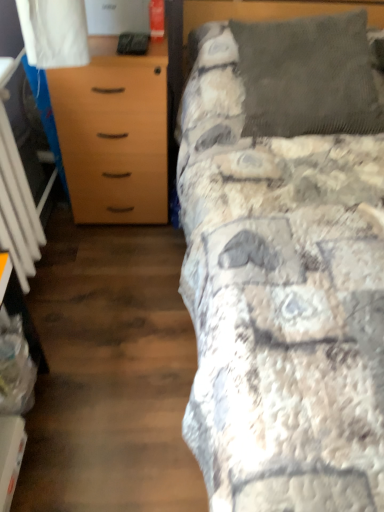
Question: From a real-world perspective, is textured gray blanket at upper right physically below light brown wood chest of drawers at left?

Choices:
 (A) yes
 (B) no

Answer: (B)

Question: Is textured gray blanket at upper right facing away from light brown wood chest of drawers at left?

Choices:
 (A) no
 (B) yes

Answer: (A)

Question: Is the position of textured gray blanket at upper right more distant than that of light brown wood chest of drawers at left?

Choices:
 (A) yes
 (B) no

Answer: (B)

Question: Considering the relative sizes of textured gray blanket at upper right and light brown wood chest of drawers at left in the image provided, is textured gray blanket at upper right bigger than light brown wood chest of drawers at left?

Choices:
 (A) yes
 (B) no

Answer: (A)

Question: Can you confirm if textured gray blanket at upper right is positioned to the right of light brown wood chest of drawers at left?

Choices:
 (A) no
 (B) yes

Answer: (B)

Question: From the image's perspective, relative to dark gray corduroy pillow at upper right, is white plastic radiator at left above or below?

Choices:
 (A) above
 (B) below

Answer: (B)

Question: Looking at their shapes, would you say white plastic radiator at left is wider or thinner than dark gray corduroy pillow at upper right?

Choices:
 (A) wide
 (B) thin

Answer: (B)

Question: In terms of height, does white plastic radiator at left look taller or shorter compared to dark gray corduroy pillow at upper right?

Choices:
 (A) short
 (B) tall

Answer: (B)

Question: Based on their sizes in the image, would you say white plastic radiator at left is bigger or smaller than dark gray corduroy pillow at upper right?

Choices:
 (A) big
 (B) small

Answer: (B)

Question: Looking at the image, does dark gray corduroy pillow at upper right seem bigger or smaller compared to white plastic radiator at left?

Choices:
 (A) big
 (B) small

Answer: (A)

Question: Is dark gray corduroy pillow at upper right wider or thinner than white plastic radiator at left?

Choices:
 (A) wide
 (B) thin

Answer: (A)

Question: From the image's perspective, relative to white plastic radiator at left, is dark gray corduroy pillow at upper right above or below?

Choices:
 (A) below
 (B) above

Answer: (B)

Question: Do you think dark gray corduroy pillow at upper right is within white plastic radiator at left, or outside of it?

Choices:
 (A) inside
 (B) outside

Answer: (B)

Question: Does point (342, 28) appear closer or farther from the camera than point (259, 305)?

Choices:
 (A) closer
 (B) farther

Answer: (B)

Question: Considering their positions, is dark gray corduroy pillow at upper right located in front of or behind textured gray blanket at upper right?

Choices:
 (A) front
 (B) behind

Answer: (B)